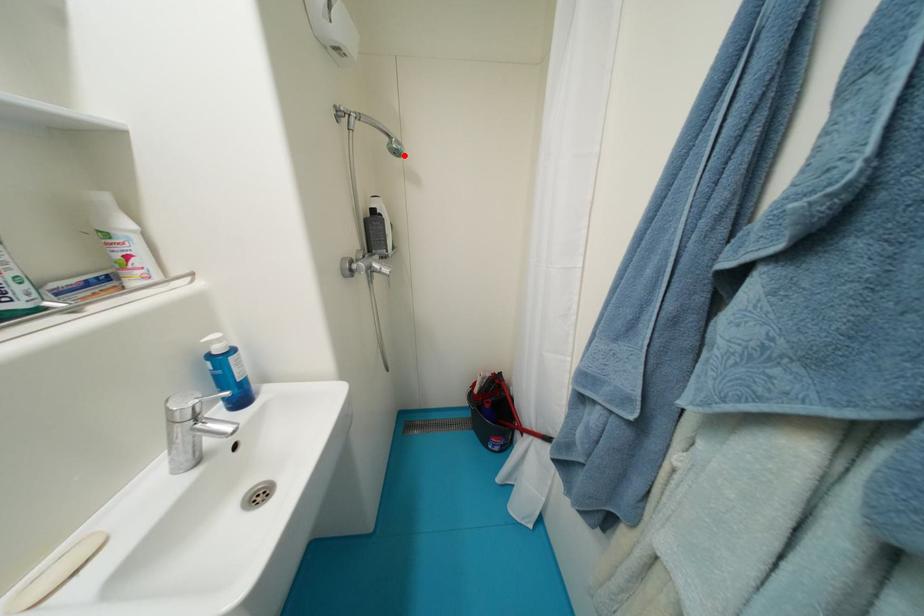
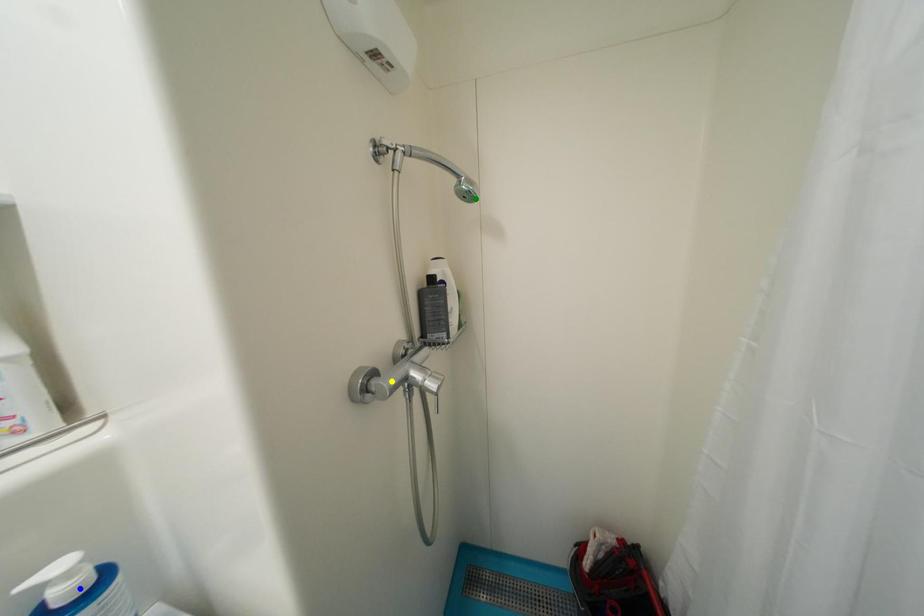
Question: I am providing you with two images of the same scene from different viewpoints. A red point is marked on the first image. You are given multiple points on the second image. Which point in image 2 is actually the same real-world point as the red point in image 1?

Choices:
 (A) yellow point
 (B) green point
 (C) blue point

Answer: (B)